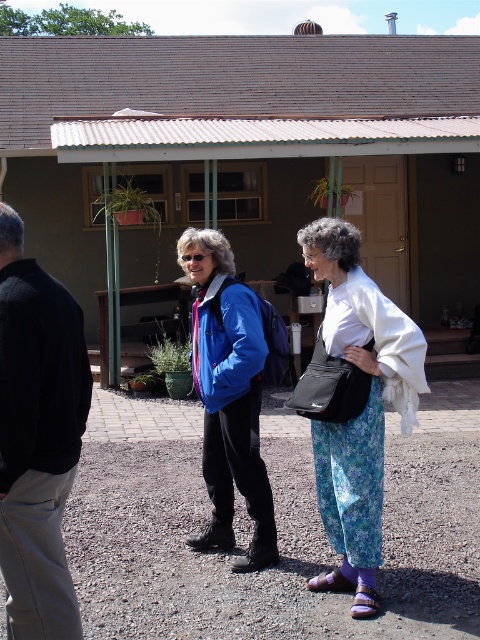
Question: Which point is farther to the camera?

Choices:
 (A) (406, 422)
 (B) (191, 230)
 (C) (47, 548)

Answer: (B)

Question: Can you confirm if black cotton pants at lower left is smaller than blue fabric jacket at center?

Choices:
 (A) yes
 (B) no

Answer: (A)

Question: Can you confirm if black cotton pants at lower left is thinner than blue fabric jacket at center?

Choices:
 (A) yes
 (B) no

Answer: (A)

Question: Which object is closer to the camera taking this photo?

Choices:
 (A) blue fabric jacket at center
 (B) floral fabric pants at center
 (C) black cotton pants at lower left

Answer: (C)

Question: Does black cotton pants at lower left come behind floral fabric pants at center?

Choices:
 (A) yes
 (B) no

Answer: (B)

Question: Among these points, which one is farthest from the camera?

Choices:
 (A) (74, 387)
 (B) (324, 332)

Answer: (B)